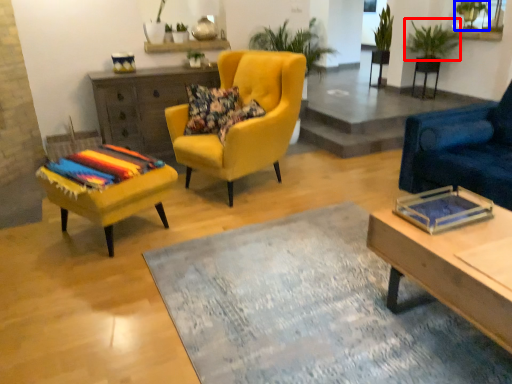
Question: Which object is further to the camera taking this photo, plant (highlighted by a red box) or plant (highlighted by a blue box)?

Choices:
 (A) plant
 (B) plant

Answer: (B)